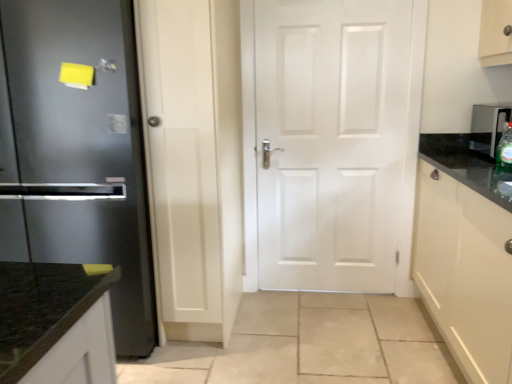
Question: From a real-world perspective, is white matte door at center below green glass bottle at right?

Choices:
 (A) yes
 (B) no

Answer: (A)

Question: Does white matte door at center lie behind green glass bottle at right?

Choices:
 (A) yes
 (B) no

Answer: (A)

Question: Does white matte door at center appear on the right side of green glass bottle at right?

Choices:
 (A) no
 (B) yes

Answer: (A)

Question: Is white matte door at center not within green glass bottle at right?

Choices:
 (A) no
 (B) yes

Answer: (B)

Question: Can you confirm if white matte door at center is wider than green glass bottle at right?

Choices:
 (A) no
 (B) yes

Answer: (A)

Question: From a real-world perspective, relative to metallic silver water dispenser at right, is glossy white cabinet at right vertically above or below?

Choices:
 (A) below
 (B) above

Answer: (A)

Question: From the image's perspective, is glossy white cabinet at right above or below metallic silver water dispenser at right?

Choices:
 (A) above
 (B) below

Answer: (B)

Question: Looking at the image, does glossy white cabinet at right seem bigger or smaller compared to metallic silver water dispenser at right?

Choices:
 (A) small
 (B) big

Answer: (B)

Question: Is point (442, 241) closer or farther from the camera than point (489, 142)?

Choices:
 (A) closer
 (B) farther

Answer: (A)

Question: Relative to green glass bottle at right, is white matte door at center in front or behind?

Choices:
 (A) front
 (B) behind

Answer: (B)

Question: Considering the positions of white matte door at center and green glass bottle at right in the image, is white matte door at center bigger or smaller than green glass bottle at right?

Choices:
 (A) big
 (B) small

Answer: (A)

Question: In terms of height, does white matte door at center look taller or shorter compared to green glass bottle at right?

Choices:
 (A) tall
 (B) short

Answer: (A)

Question: Based on their positions, is white matte door at center located to the left or right of green glass bottle at right?

Choices:
 (A) right
 (B) left

Answer: (B)

Question: Considering the positions of glossy white cabinet at right and white matte door at center in the image, is glossy white cabinet at right wider or thinner than white matte door at center?

Choices:
 (A) thin
 (B) wide

Answer: (B)

Question: Is glossy white cabinet at right taller or shorter than white matte door at center?

Choices:
 (A) short
 (B) tall

Answer: (A)